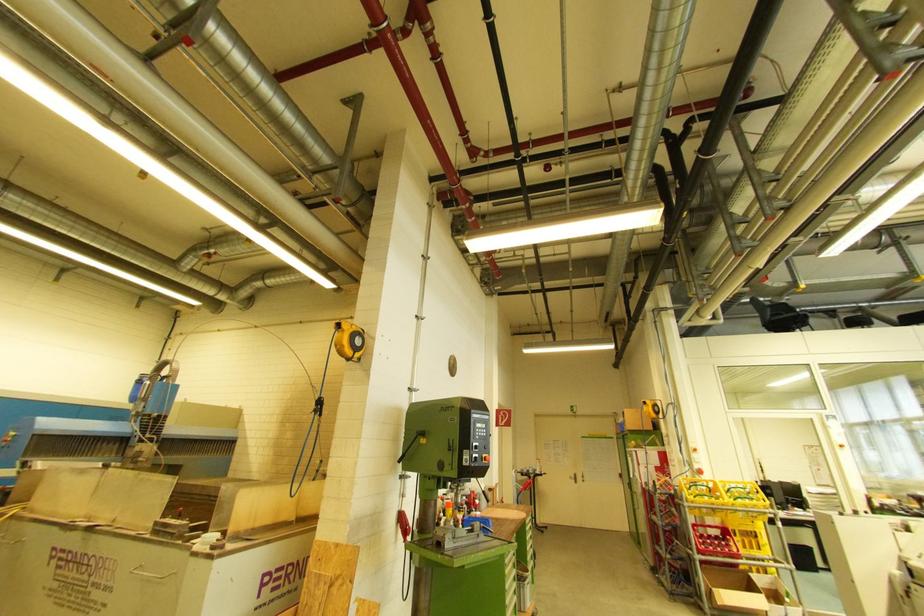
Find where to turn the metal door handle. Please return your answer as a coordinate pair (x, y).

(572, 477)